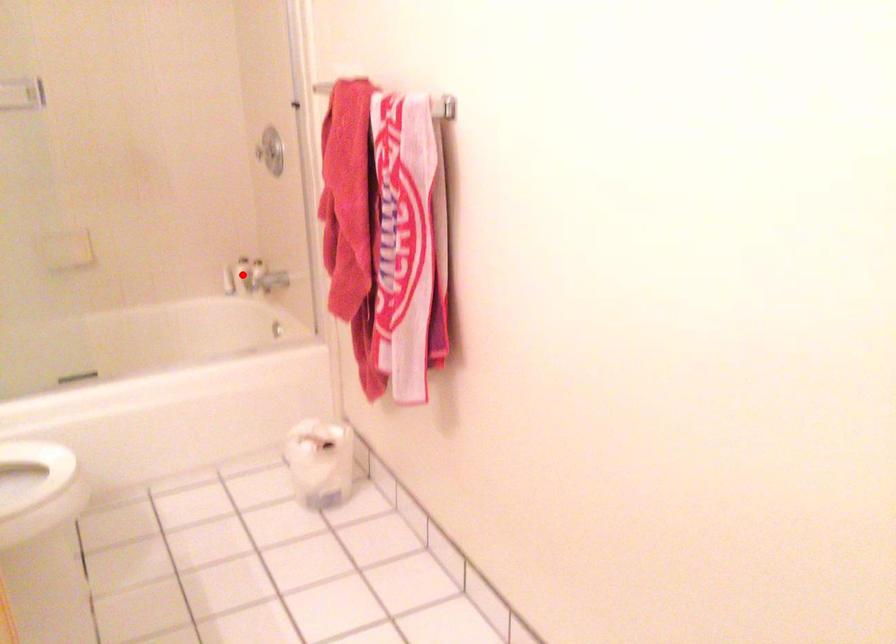
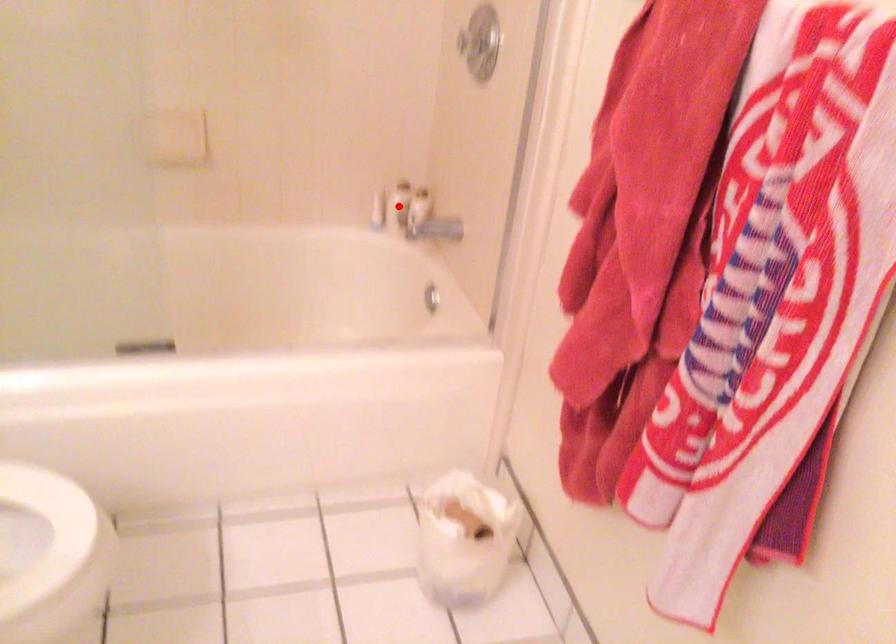
I am providing you with two images of the same scene from different viewpoints. A red point is marked on the first image and another point is marked on the second image. Do the highlighted points in image1 and image2 indicate the same real-world spot?

Yes